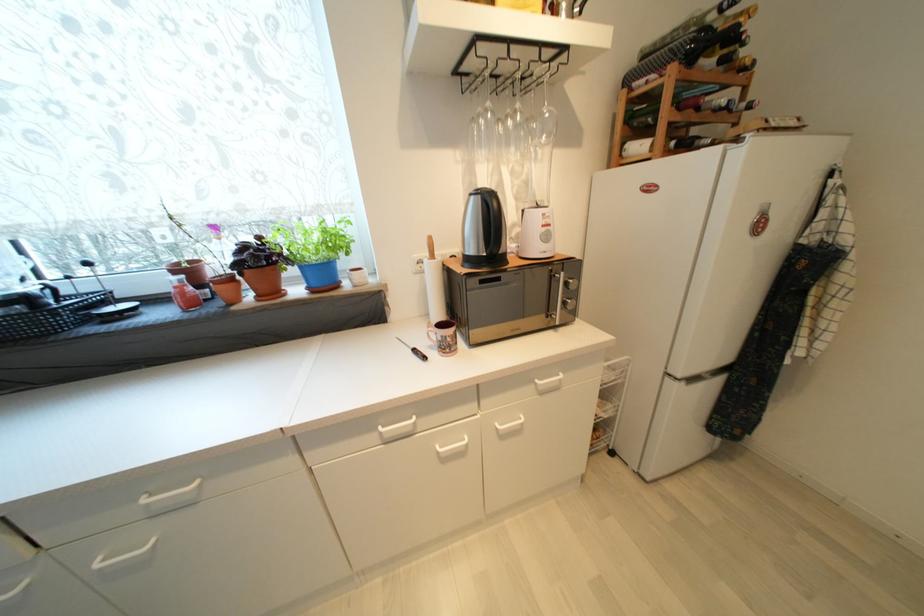
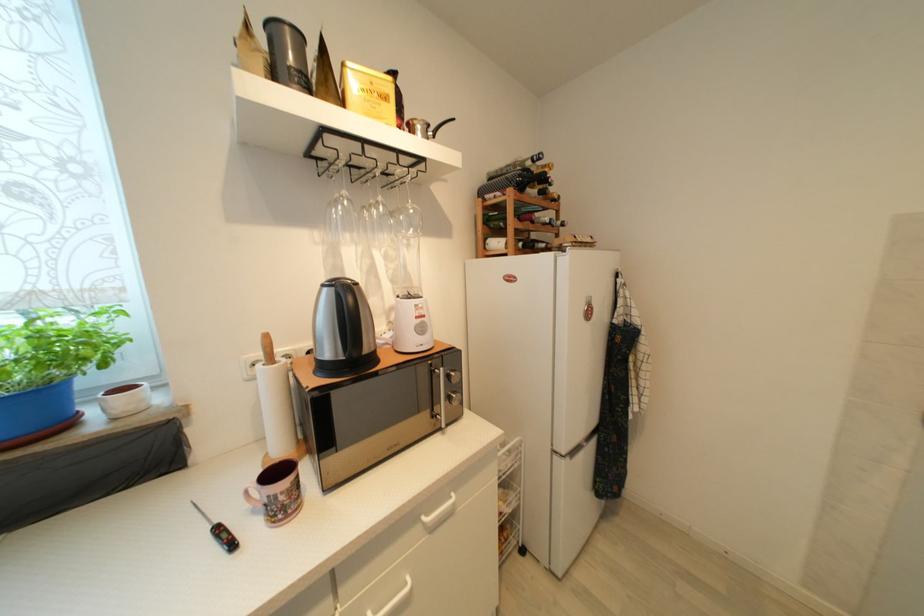
Locate, in the second image, the point that corresponds to (x=569, y=305) in the first image.

(455, 400)